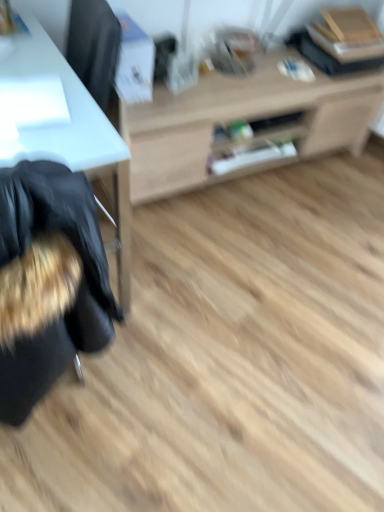
Question: Is fuzzy black bean bag chair at left thinner than light wood cabinet at center?

Choices:
 (A) yes
 (B) no

Answer: (A)

Question: Does fuzzy black bean bag chair at left appear on the right side of light wood cabinet at center?

Choices:
 (A) no
 (B) yes

Answer: (A)

Question: Is fuzzy black bean bag chair at left not within light wood cabinet at center?

Choices:
 (A) no
 (B) yes

Answer: (B)

Question: Is light wood cabinet at center a part of fuzzy black bean bag chair at left?

Choices:
 (A) yes
 (B) no

Answer: (B)

Question: Considering the relative sizes of fuzzy black bean bag chair at left and light wood cabinet at center in the image provided, is fuzzy black bean bag chair at left shorter than light wood cabinet at center?

Choices:
 (A) no
 (B) yes

Answer: (A)

Question: In terms of height, does light wood cabinet at center look taller or shorter compared to fuzzy black bean bag chair at left?

Choices:
 (A) tall
 (B) short

Answer: (B)

Question: Is light wood cabinet at center to the left or to the right of fuzzy black bean bag chair at left in the image?

Choices:
 (A) right
 (B) left

Answer: (A)

Question: Looking at their shapes, would you say light wood cabinet at center is wider or thinner than fuzzy black bean bag chair at left?

Choices:
 (A) wide
 (B) thin

Answer: (A)

Question: In terms of size, does light wood cabinet at center appear bigger or smaller than fuzzy black bean bag chair at left?

Choices:
 (A) small
 (B) big

Answer: (B)

Question: From the image's perspective, relative to light wood cabinet at center, is fuzzy black bean bag chair at left above or below?

Choices:
 (A) above
 (B) below

Answer: (B)

Question: From a real-world perspective, is fuzzy black bean bag chair at left positioned above or below light wood cabinet at center?

Choices:
 (A) below
 (B) above

Answer: (B)

Question: Is point (69, 216) closer or farther from the camera than point (276, 82)?

Choices:
 (A) closer
 (B) farther

Answer: (A)

Question: Considering the positions of fuzzy black bean bag chair at left and light wood cabinet at center in the image, is fuzzy black bean bag chair at left wider or thinner than light wood cabinet at center?

Choices:
 (A) wide
 (B) thin

Answer: (B)

Question: Visually, is light wood cabinet at center positioned to the left or to the right of white glossy desk at left?

Choices:
 (A) right
 (B) left

Answer: (A)

Question: Is light wood cabinet at center bigger or smaller than white glossy desk at left?

Choices:
 (A) small
 (B) big

Answer: (B)